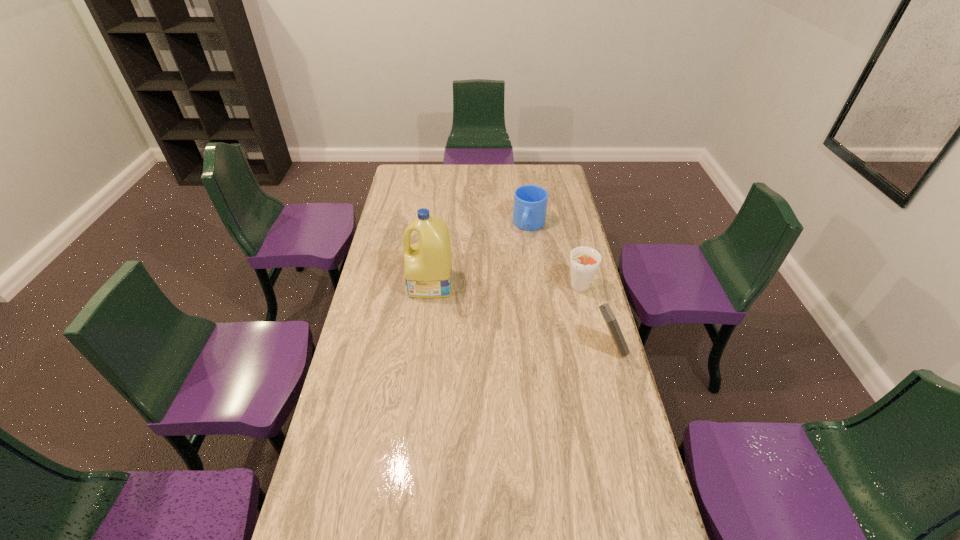
The width and height of the screenshot is (960, 540). In order to click on free spot on the desktop that is between the detergent and the calculator and is positioned on the drink side of the root beer in this screenshot , I will do `click(525, 318)`.

Locate an element on the screen. The image size is (960, 540). free spot on the desktop that is between the leftmost object and the nearest object and is positioned on the side of the mug with the handle is located at coordinates (503, 310).